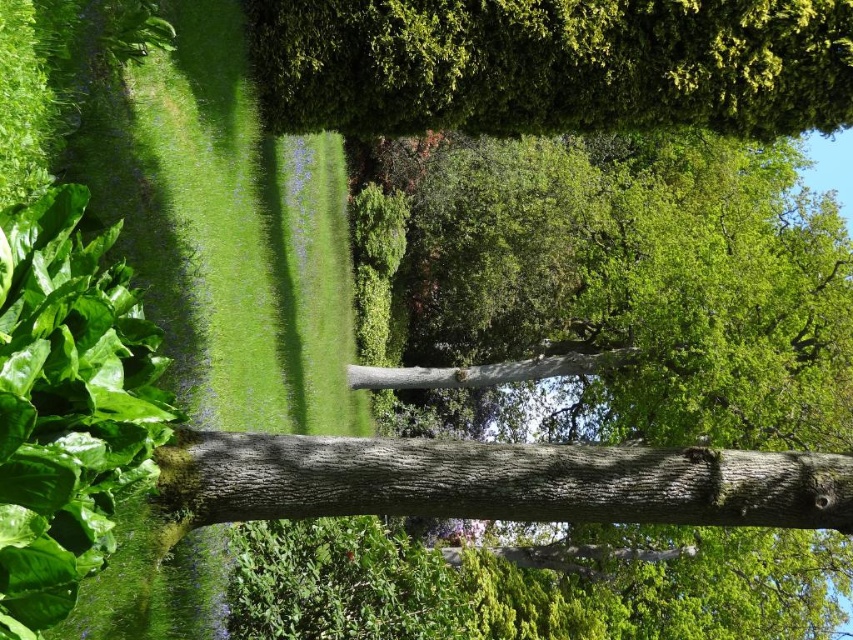
Based on the scene description and the location of the green leafy tree at upper center, what is the 2D coordinate of the tree in the image?

The 2D coordinate of the green leafy tree at upper center is at point (554, 65).

You are standing in the garden and want to take a photo of the point at coordinates point [840,0]. If your camera has a maximum focus range of 30 feet, will it be able to focus on that point?

The point [840,0] is 30.92 feet from the camera, which exceeds the maximum focus range of 30 feet. Therefore, the camera will not be able to focus on that point.

You are standing in the garden and want to take a photo of both the green leafy tree at upper center and the smooth brown tree trunk at center. Which object should you focus on first if you want to ensure both are in the frame?

The green leafy tree at upper center is taller than the smooth brown tree trunk at center, so you should focus on the green leafy tree at upper center first to ensure it fits within the frame.